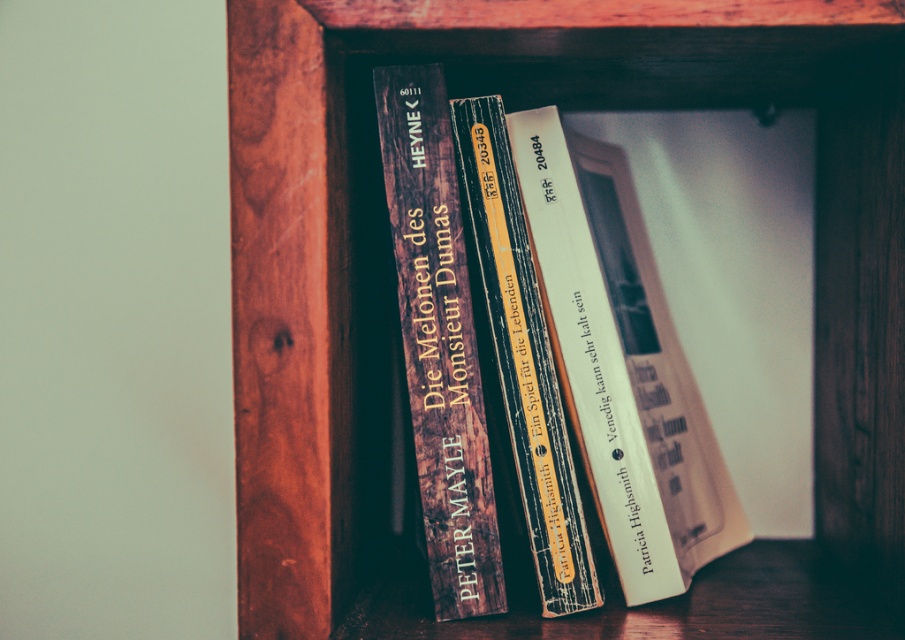
Is white paper book at center closer to camera compared to wooden spines at center?

No, it is behind wooden spines at center.

In the scene shown: Can you confirm if white paper book at center is thinner than wooden spines at center?

No, white paper book at center is not thinner than wooden spines at center.

What do you see at coordinates (621, 364) in the screenshot?
I see `white paper book at center` at bounding box center [621, 364].

I want to click on white paper book at center, so click(621, 364).

Between point (416, 397) and point (480, 182), which one is positioned behind?

Positioned behind is point (480, 182).

Does wooden book at center appear over wooden spines at center?

Yes.

Between point (391, 184) and point (519, 433), which one is positioned in front?

Point (391, 184) is in front.

I want to click on wooden book at center, so click(x=437, y=342).

Is point (634, 12) positioned before point (498, 540)?

Yes, point (634, 12) is closer to viewer.

Between wooden bookshelf at center and wooden book at center, which one is positioned lower?

wooden book at center

This screenshot has height=640, width=905. Describe the element at coordinates (518, 108) in the screenshot. I see `wooden bookshelf at center` at that location.

Find the location of a particular element. The image size is (905, 640). wooden bookshelf at center is located at coordinates (518, 108).